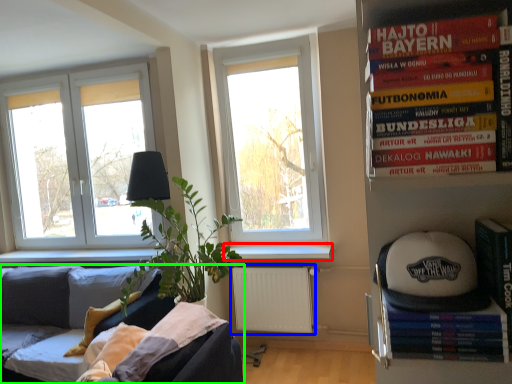
Question: Which object is the closest to the window sill (highlighted by a red box)? Choose among these: radiator (highlighted by a blue box) or studio couch (highlighted by a green box).

Choices:
 (A) radiator
 (B) studio couch

Answer: (A)